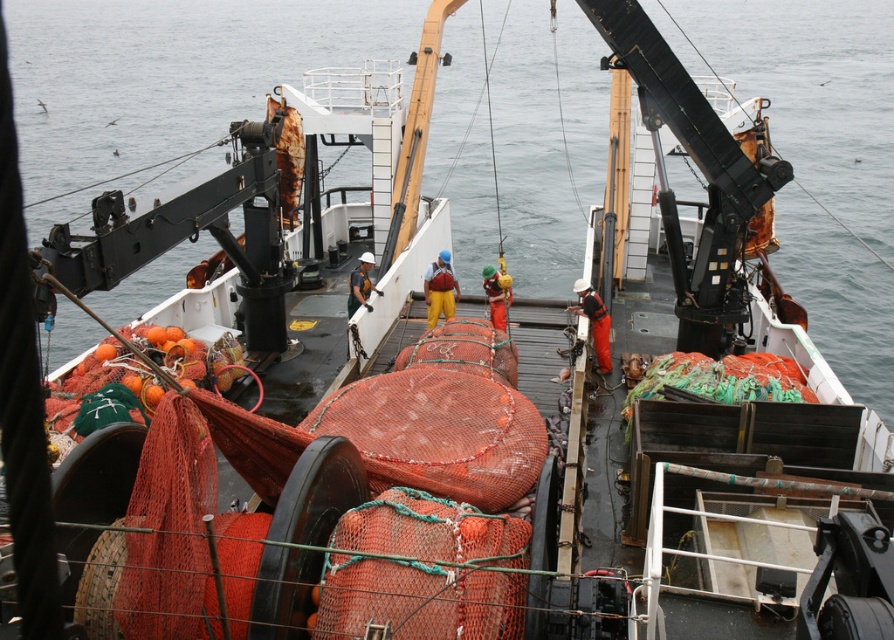
You are standing on the deck of the fishing vessel and want to move from the point at coordinates point (485,276) to the point at coordinates point (370,259). Which direction should you move?

You should move backward since point (485,276) is in front of point (370,259).

In the scene shown: You are a deckhand on a fishing vessel. You need to retrieve an item that fell between the yellow fabric at center and the matte orange net at center. Which object should you move first to access the item?

The yellow fabric at center is above the matte orange net at center, so you should move the yellow fabric at center first to access the item.

You are navigating a small drone that needs to land on the deck of the fishing vessel. The drone has a safety radius of 0.4 meters. Are there any objects within this radius that might interfere with the landing near the orange fabric worker at center?

The orange fabric worker at center is located at point (496,296). Since the drone has a safety radius of 0.4 meters, any objects within this radius could interfere. However, the provided information does not specify other objects near this location, so it is assumed safe unless there are unmentioned obstacles.